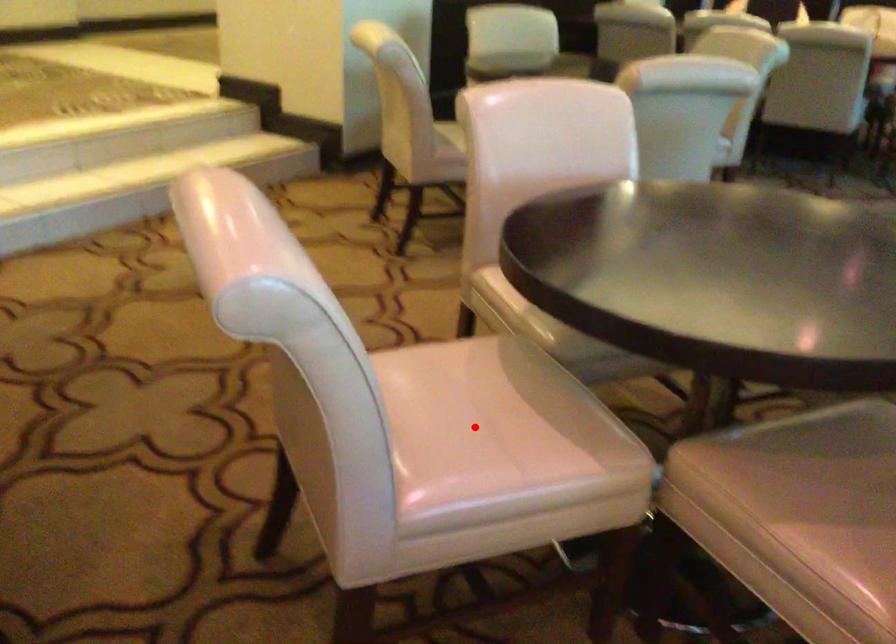
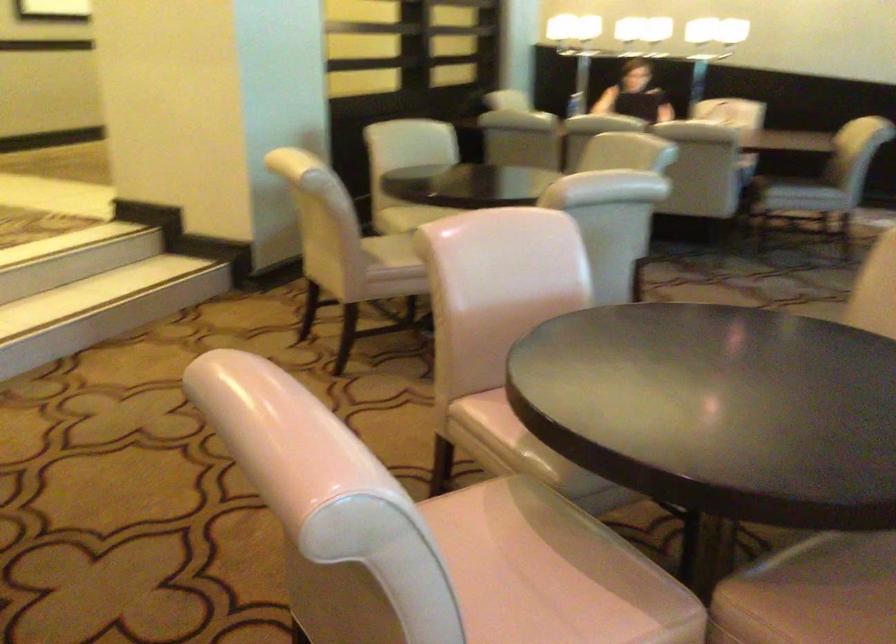
Find the pixel in the second image that matches the highlighted location in the first image.

(520, 587)